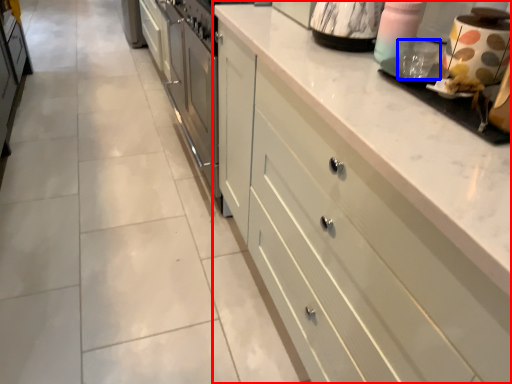
Question: Which object appears closest to the camera in this image, cabinetry (highlighted by a red box) or appliance (highlighted by a blue box)?

Choices:
 (A) cabinetry
 (B) appliance

Answer: (A)